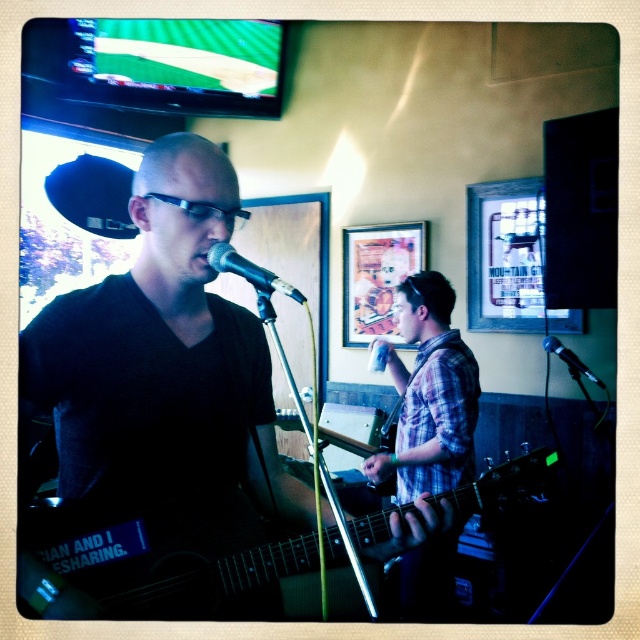
Which of these two, plaid fabric shirt at center or black metallic microphone at right, stands shorter?

black metallic microphone at right is shorter.

From the picture: Between plaid fabric shirt at center and black metallic microphone at right, which one appears on the left side from the viewer's perspective?

From the viewer's perspective, plaid fabric shirt at center appears more on the left side.

This screenshot has height=640, width=640. Find the location of `plaid fabric shirt at center`. plaid fabric shirt at center is located at coordinates (429, 396).

Which is more to the left, black matte guitar at center or metallic silver microphone at center?

black matte guitar at center

Does black matte guitar at center appear under metallic silver microphone at center?

Yes.

The image size is (640, 640). What do you see at coordinates (161, 356) in the screenshot?
I see `black matte guitar at center` at bounding box center [161, 356].

Locate an element on the screen. black matte guitar at center is located at coordinates (161, 356).

Image resolution: width=640 pixels, height=640 pixels. What do you see at coordinates (184, 561) in the screenshot? I see `acoustic wood guitar at center` at bounding box center [184, 561].

Who is positioned more to the right, acoustic wood guitar at center or black metallic microphone at right?

black metallic microphone at right is more to the right.

I want to click on acoustic wood guitar at center, so click(184, 561).